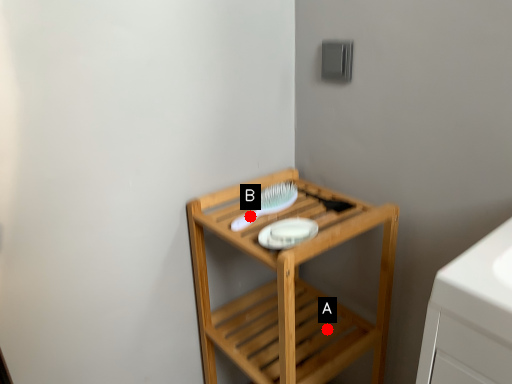
Question: Two points are circled on the image, labeled by A and B beside each circle. Which point is further to the camera?

Choices:
 (A) A is further
 (B) B is further

Answer: (A)